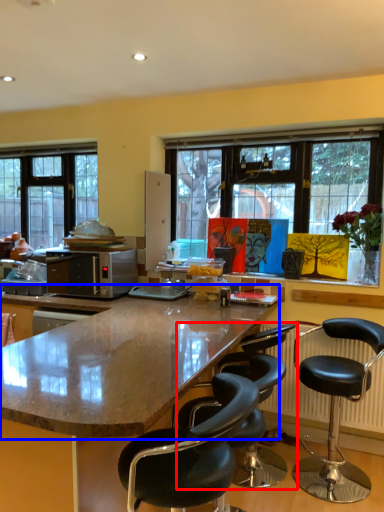
Question: Which point is closer to the camera, chair (highlighted by a red box) or countertop (highlighted by a blue box)?

Choices:
 (A) chair
 (B) countertop

Answer: (B)